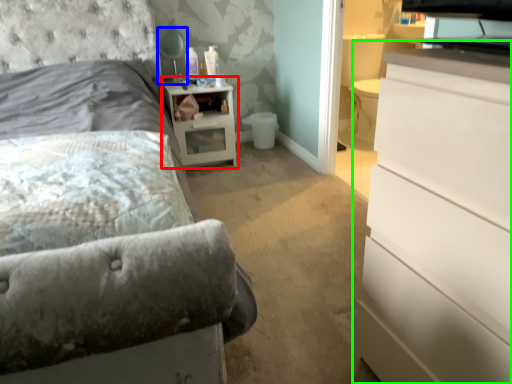
Question: Which object is the closest to the nightstand (highlighted by a red box)? Choose among these: table lamp (highlighted by a blue box) or chest of drawers (highlighted by a green box).

Choices:
 (A) table lamp
 (B) chest of drawers

Answer: (A)